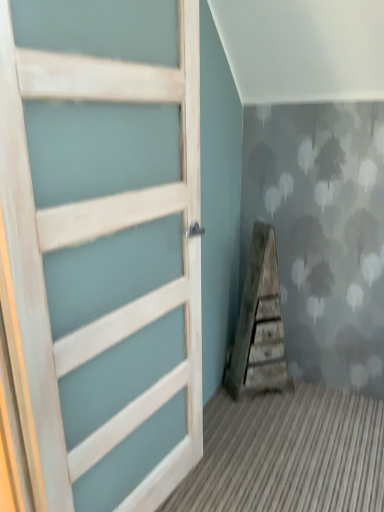
Where is `weathered wood staircase at center`? The height and width of the screenshot is (512, 384). weathered wood staircase at center is located at coordinates 259,323.

In order to face weathered wood staircase at center, should I rotate leftwards or rightwards?

You should rotate right by 9.401 degrees.

What do you see at coordinates (259, 323) in the screenshot? Image resolution: width=384 pixels, height=512 pixels. I see `weathered wood staircase at center` at bounding box center [259, 323].

In order to face white wood door at left, should I rotate leftwards or rightwards?

You should rotate left by 8.492 degrees.

Find the location of a particular element. This screenshot has height=512, width=384. white wood door at left is located at coordinates (101, 250).

Describe the element at coordinates (101, 250) in the screenshot. I see `white wood door at left` at that location.

I want to click on weathered wood staircase at center, so click(259, 323).

Can you confirm if weathered wood staircase at center is positioned to the left of white wood door at left?

No, weathered wood staircase at center is not to the left of white wood door at left.

Does weathered wood staircase at center lie in front of white wood door at left?

No, weathered wood staircase at center is behind white wood door at left.

Which is nearer, [267,225] or [153,273]?

Clearly, point [267,225] is more distant from the camera than point [153,273].

From the image's perspective, relative to white wood door at left, is weathered wood staircase at center above or below?

Clearly, from the image's perspective, weathered wood staircase at center is below white wood door at left.

From a real-world perspective, which object rests below the other?

weathered wood staircase at center, from a real-world perspective.

Which of these two, weathered wood staircase at center or white wood door at left, is wider?

With larger width is weathered wood staircase at center.

Can you confirm if weathered wood staircase at center is shorter than white wood door at left?

Correct, weathered wood staircase at center is not as tall as white wood door at left.

Between weathered wood staircase at center and white wood door at left, which one has smaller size?

weathered wood staircase at center.

Can white wood door at left be found inside weathered wood staircase at center?

Actually, white wood door at left is outside weathered wood staircase at center.

Is the surface of weathered wood staircase at center in direct contact with white wood door at left?

No, weathered wood staircase at center is not with white wood door at left.

Is weathered wood staircase at center turned away from white wood door at left?

weathered wood staircase at center is not turned away from white wood door at left.

How many degrees apart are the facing directions of weathered wood staircase at center and white wood door at left?

38.1 degrees.

The width and height of the screenshot is (384, 512). In order to click on door in front of the weathered wood staircase at center in this screenshot , I will do `click(101, 250)`.

Is white wood door at left to the left or to the right of weathered wood staircase at center in the image?

Based on their positions, white wood door at left is located to the left of weathered wood staircase at center.

Is white wood door at left in front of or behind weathered wood staircase at center in the image?

white wood door at left is in front of weathered wood staircase at center.

Considering the positions of points (82, 151) and (246, 370), is point (82, 151) farther from camera compared to point (246, 370)?

No, it is not.

From the image's perspective, who appears lower, white wood door at left or weathered wood staircase at center?

weathered wood staircase at center.

From a real-world perspective, between white wood door at left and weathered wood staircase at center, who is vertically lower?

In real-world perspective, weathered wood staircase at center is lower.

Does white wood door at left have a lesser width compared to weathered wood staircase at center?

Indeed, white wood door at left has a lesser width compared to weathered wood staircase at center.

Looking at this image, who is shorter, white wood door at left or weathered wood staircase at center?

weathered wood staircase at center.

Based on the photo, in terms of size, does white wood door at left appear bigger or smaller than weathered wood staircase at center?

Clearly, white wood door at left is larger in size than weathered wood staircase at center.

Is white wood door at left inside or outside of weathered wood staircase at center?

white wood door at left is not enclosed by weathered wood staircase at center.

Is white wood door at left beside weathered wood staircase at center?

white wood door at left is not next to weathered wood staircase at center, and they're not touching.

Is white wood door at left facing towards weathered wood staircase at center?

No, white wood door at left is not turned towards weathered wood staircase at center.

How different are the orientations of white wood door at left and weathered wood staircase at center in degrees?

There is a 38.1-degree angle between the facing directions of white wood door at left and weathered wood staircase at center.

This screenshot has width=384, height=512. Find the location of `stairwell on the right of white wood door at left`. stairwell on the right of white wood door at left is located at coordinates (259, 323).

The image size is (384, 512). In order to click on door above the weathered wood staircase at center (from a real-world perspective) in this screenshot , I will do `click(101, 250)`.

Locate an element on the screen. This screenshot has height=512, width=384. stairwell below the white wood door at left (from a real-world perspective) is located at coordinates (259, 323).